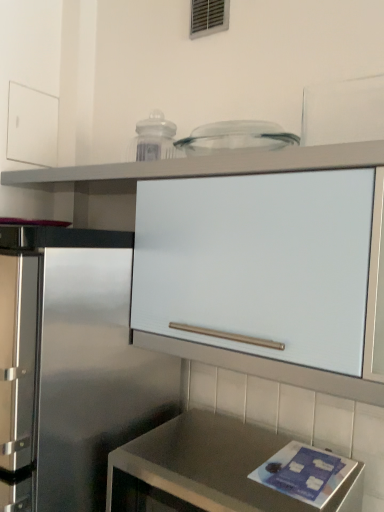
Question: From the image's perspective, is metallic vent at upper center below white matte drawer at upper left?

Choices:
 (A) yes
 (B) no

Answer: (B)

Question: Is there a large distance between metallic vent at upper center and white matte drawer at upper left?

Choices:
 (A) no
 (B) yes

Answer: (A)

Question: Is metallic vent at upper center positioned beyond the bounds of white matte drawer at upper left?

Choices:
 (A) no
 (B) yes

Answer: (B)

Question: Is white matte drawer at upper left at the back of metallic vent at upper center?

Choices:
 (A) yes
 (B) no

Answer: (B)

Question: Does metallic vent at upper center appear on the left side of white matte drawer at upper left?

Choices:
 (A) no
 (B) yes

Answer: (A)

Question: Is metallic vent at upper center placed right next to white matte drawer at upper left?

Choices:
 (A) yes
 (B) no

Answer: (B)

Question: From a real-world perspective, is white matte drawer at upper left located beneath white matte cabinet at upper center?

Choices:
 (A) no
 (B) yes

Answer: (A)

Question: Considering the relative positions of white matte drawer at upper left and white matte cabinet at upper center in the image provided, is white matte drawer at upper left to the left of white matte cabinet at upper center from the viewer's perspective?

Choices:
 (A) no
 (B) yes

Answer: (B)

Question: Can you confirm if white matte drawer at upper left is bigger than white matte cabinet at upper center?

Choices:
 (A) no
 (B) yes

Answer: (A)

Question: Is white matte drawer at upper left not inside white matte cabinet at upper center?

Choices:
 (A) no
 (B) yes

Answer: (B)

Question: Is white matte drawer at upper left shorter than white matte cabinet at upper center?

Choices:
 (A) yes
 (B) no

Answer: (A)

Question: From the image's perspective, is white matte drawer at upper left beneath white matte cabinet at upper center?

Choices:
 (A) yes
 (B) no

Answer: (B)

Question: Is white matte cabinet at upper center thinner than metallic vent at upper center?

Choices:
 (A) yes
 (B) no

Answer: (B)